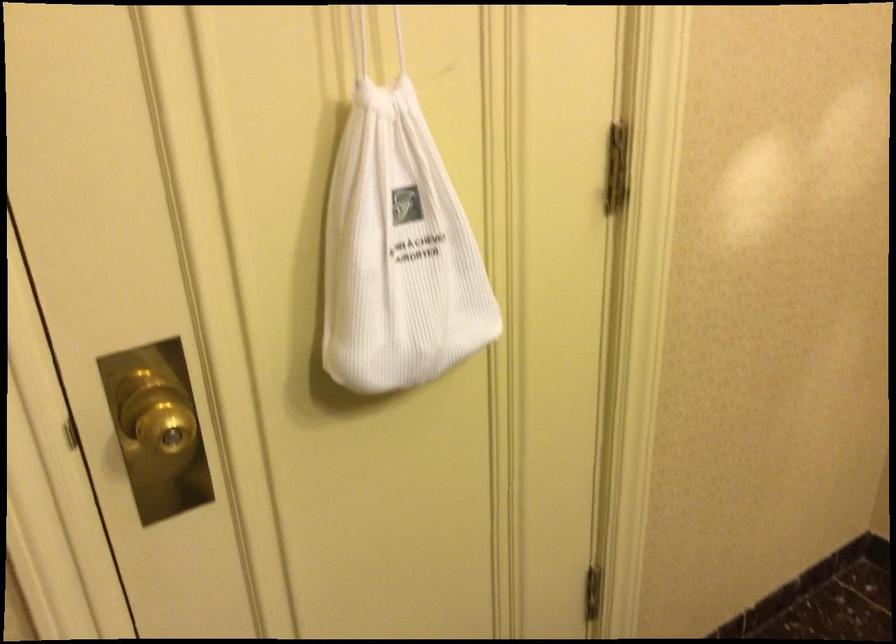
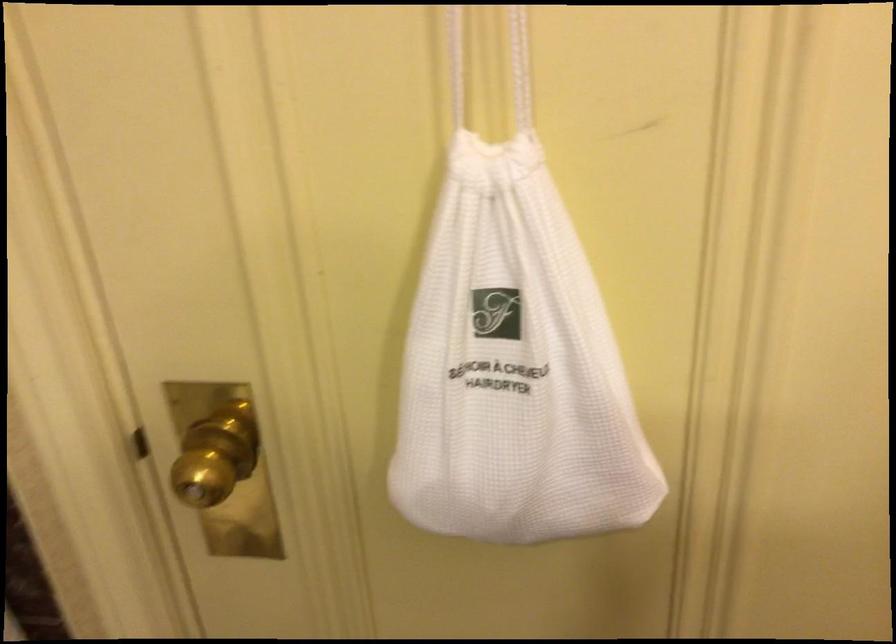
In the second image, find the point that corresponds to (149,422) in the first image.

(216, 456)